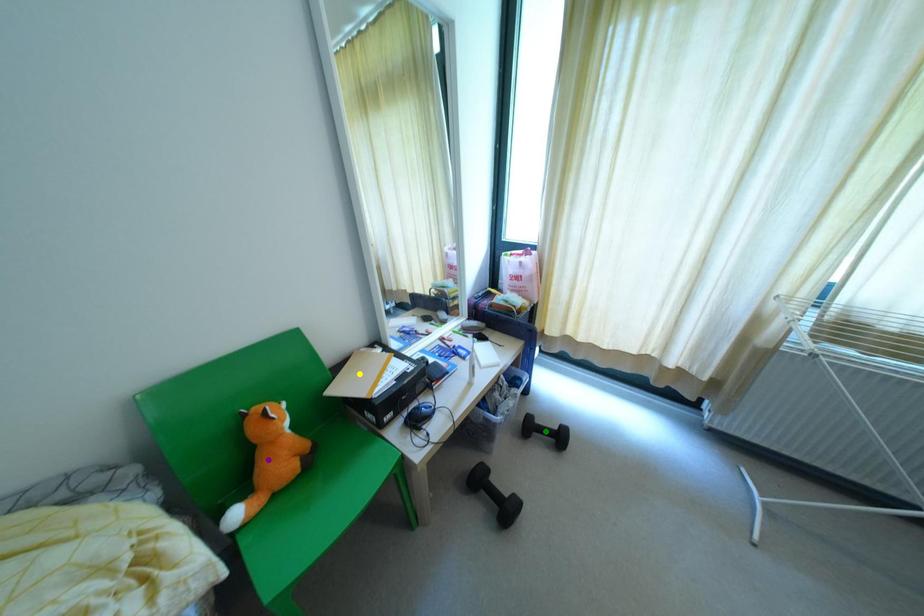
Order these from nearest to farthest:
yellow point, purple point, green point

purple point < yellow point < green point